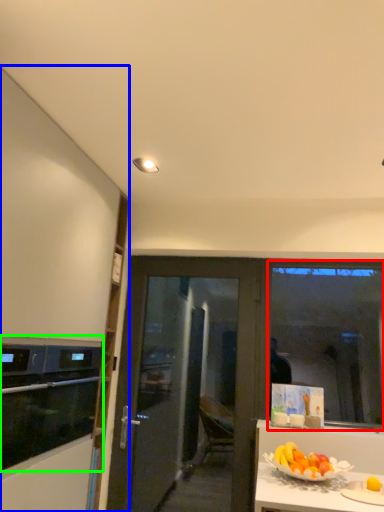
Question: Based on their relative distances, which object is farther from window screen (highlighted by a red box)? Choose from cabinetry (highlighted by a blue box) and kitchen appliance (highlighted by a green box).

Choices:
 (A) cabinetry
 (B) kitchen appliance

Answer: (A)